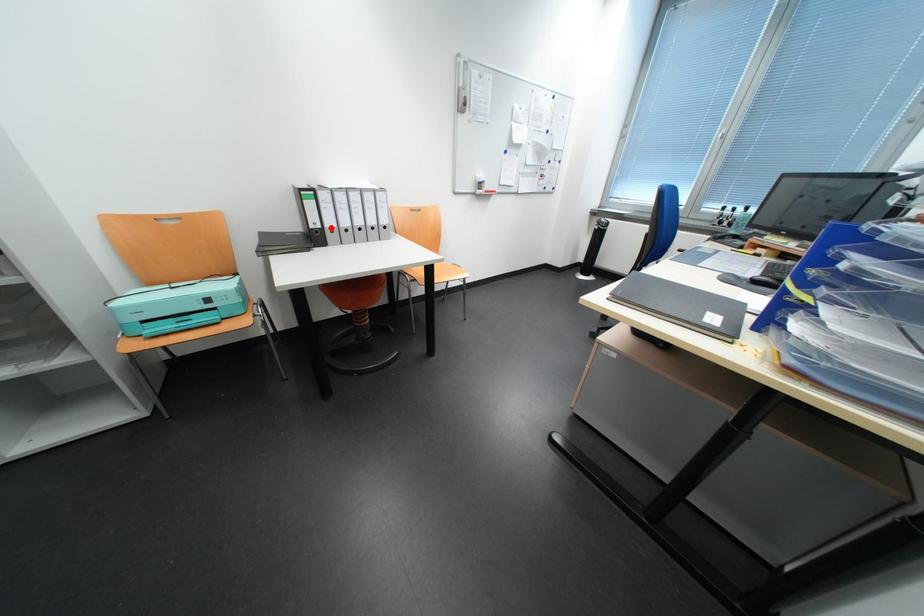
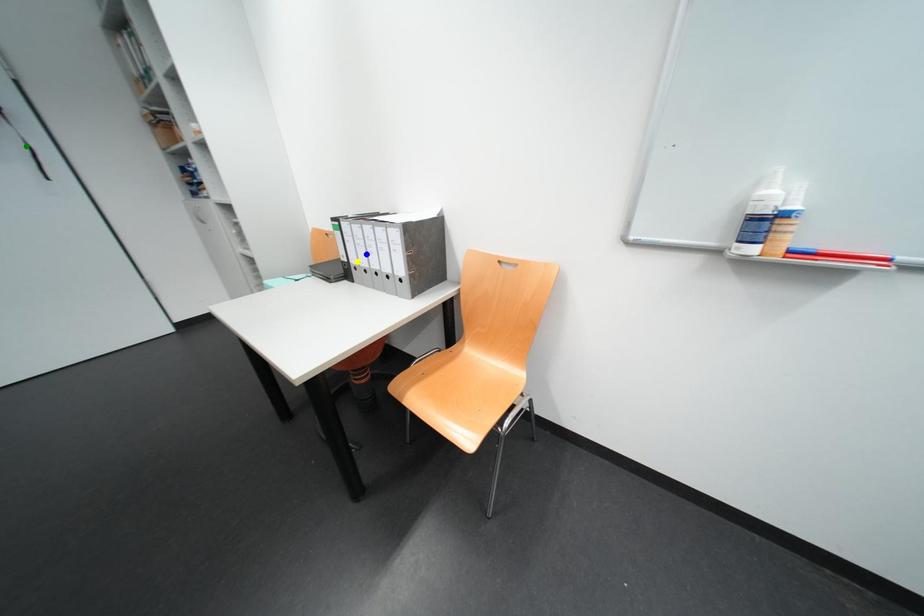
Question: I am providing you with two images of the same scene from different viewpoints. A red point is marked on the first image. You are given multiple points on the second image. Which mark in image 2 goes with the point in image 1?

Choices:
 (A) green point
 (B) blue point
 (C) yellow point

Answer: (C)